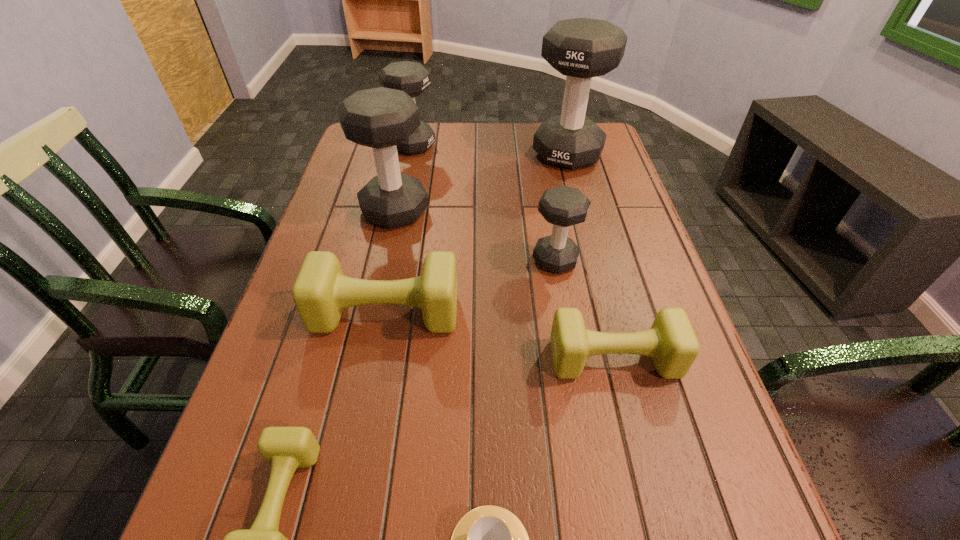
Where is `the biggest gray dumbbell`? Image resolution: width=960 pixels, height=540 pixels. the biggest gray dumbbell is located at coordinates (581, 48).

Find the location of a particular element. the tallest dumbbell is located at coordinates (581, 48).

Locate an element on the screen. This screenshot has width=960, height=540. the second tallest object is located at coordinates (381, 118).

Where is `the third farthest gray dumbbell`? This screenshot has width=960, height=540. the third farthest gray dumbbell is located at coordinates (381, 118).

I want to click on the sixth shortest object, so click(x=413, y=78).

Locate an element on the screen. the third biggest gray dumbbell is located at coordinates (413, 78).

Locate an element on the screen. The width and height of the screenshot is (960, 540). the fourth farthest dumbbell is located at coordinates (563, 206).

Where is `the nearest gray dumbbell`? The width and height of the screenshot is (960, 540). the nearest gray dumbbell is located at coordinates (563, 206).

The height and width of the screenshot is (540, 960). Find the location of `the fourth nearest object`. the fourth nearest object is located at coordinates (320, 293).

In order to click on the fifth tallest object in this screenshot , I will do `click(320, 293)`.